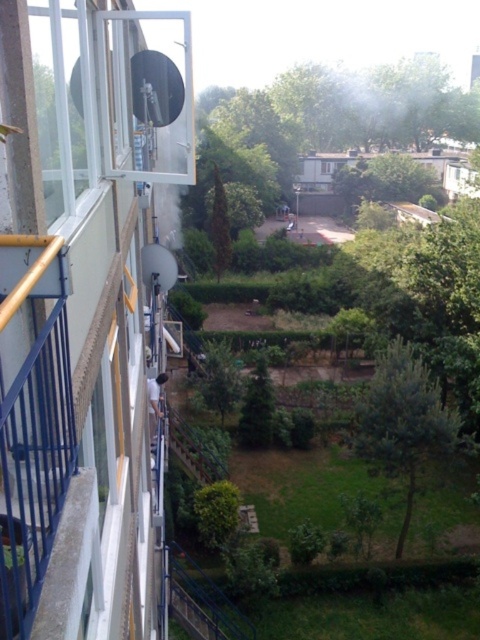
Consider the image. Which is more to the left, green leafy tree at center or green matte tree at center?

green leafy tree at center is more to the left.

Is point (204, 513) farther from viewer compared to point (252, 432)?

No, (204, 513) is in front of (252, 432).

I want to click on green leafy tree at center, so click(216, 512).

From the picture: Can you confirm if green leafy tree at lower right is positioned above green matte tree at center?

Yes, green leafy tree at lower right is above green matte tree at center.

This screenshot has width=480, height=640. I want to click on green leafy tree at lower right, so click(402, 420).

Is point (409, 474) farther from viewer compared to point (264, 412)?

That is False.

Locate an element on the screen. The width and height of the screenshot is (480, 640). green leafy tree at lower right is located at coordinates (402, 420).

Does green leafy tree at lower right appear on the right side of green leafy tree at center?

Yes, green leafy tree at lower right is to the right of green leafy tree at center.

Between green leafy tree at lower right and green leafy tree at center, which one has more height?

green leafy tree at center

Describe the element at coordinates (402, 420) in the screenshot. I see `green leafy tree at lower right` at that location.

Locate an element on the screen. This screenshot has height=640, width=480. green leafy tree at lower right is located at coordinates (402, 420).